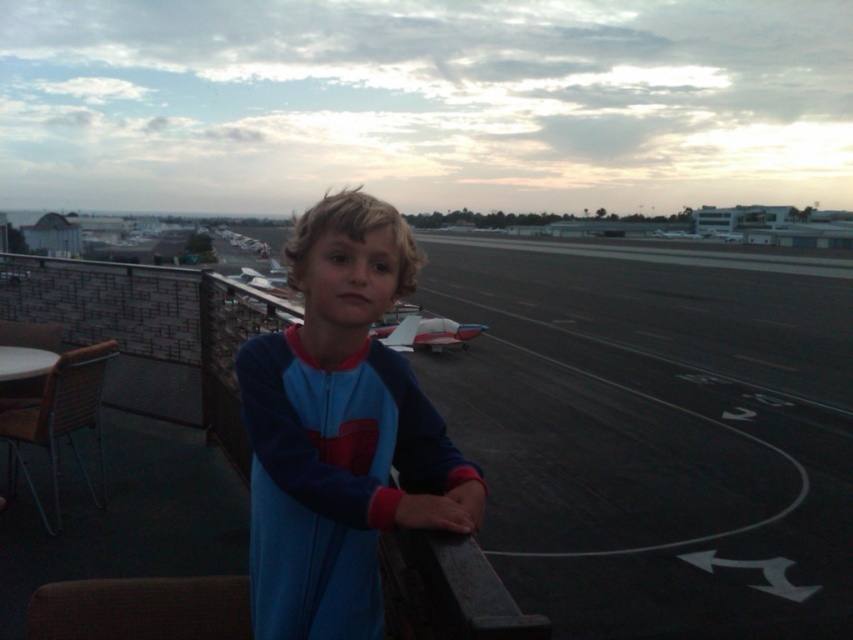
Can you confirm if black asphalt tarmac at center is thinner than blue fleece at center?

In fact, black asphalt tarmac at center might be wider than blue fleece at center.

Is point (846, 588) closer to camera compared to point (323, 612)?

That is False.

What do you see at coordinates (653, 428) in the screenshot?
I see `black asphalt tarmac at center` at bounding box center [653, 428].

You are a GUI agent. You are given a task and a screenshot of the screen. Output one action in this format:
    pyautogui.click(x=<x>, y=<y>)
    Task: Click on the black asphalt tarmac at center
    This screenshot has width=853, height=640.
    Given the screenshot: What is the action you would take?
    pyautogui.click(x=653, y=428)

In the scene shown: Is black asphalt tarmac at center thinner than white matte airplane at center?

Incorrect, black asphalt tarmac at center's width is not less than white matte airplane at center's.

Is black asphalt tarmac at center shorter than white matte airplane at center?

Incorrect, black asphalt tarmac at center's height does not fall short of white matte airplane at center's.

Locate an element on the screen. black asphalt tarmac at center is located at coordinates (653, 428).

Who is taller, red and white plastic airplane at center or white matte airplane at center?

With more height is white matte airplane at center.

Does red and white plastic airplane at center appear over white matte airplane at center?

Actually, red and white plastic airplane at center is below white matte airplane at center.

This screenshot has height=640, width=853. What do you see at coordinates (426, 330) in the screenshot? I see `red and white plastic airplane at center` at bounding box center [426, 330].

Identify the location of red and white plastic airplane at center. This screenshot has height=640, width=853. (426, 330).